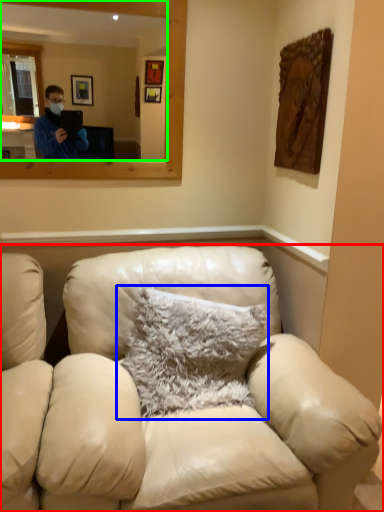
Question: Considering the real-world distances, which object is closest to studio couch (highlighted by a red box)? pillow (highlighted by a blue box) or mirror (highlighted by a green box).

Choices:
 (A) pillow
 (B) mirror

Answer: (A)